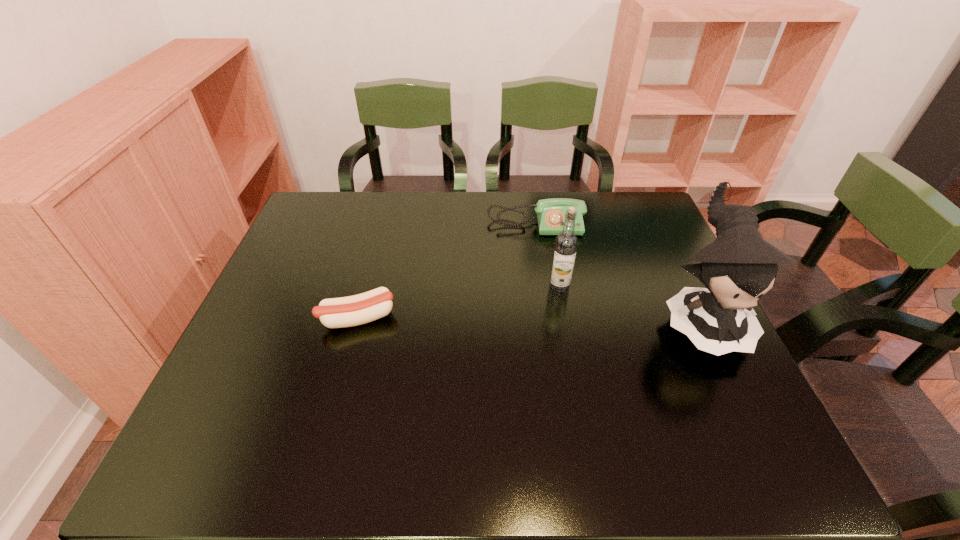
I want to click on empty location between the vodka and the sausage, so click(x=458, y=303).

At what (x,y) coordinates should I click in order to perform the action: click on free point between the second tallest object and the farthest object. Please return your answer as a coordinate pair (x, y). The width and height of the screenshot is (960, 540). Looking at the image, I should click on (547, 256).

Find the location of a particular element. The width and height of the screenshot is (960, 540). free spot between the leftmost object and the farthest object is located at coordinates (446, 271).

Identify the location of the closest object to the telephone. (566, 242).

Choose which object is the third nearest neighbor to the farthest object. Please provide its 2D coordinates. Your answer should be formatted as a tuple, i.e. [(x, y)], where the tuple contains the x and y coordinates of a point satisfying the conditions above.

[(366, 307)]

The height and width of the screenshot is (540, 960). What are the coordinates of `free space that satisfies the following two spatial constraints: 1. on the front side of the vodka; 2. on the left side of the second shortest object` in the screenshot? It's located at (546, 288).

The width and height of the screenshot is (960, 540). Identify the location of free region that satisfies the following two spatial constraints: 1. on the back side of the third tallest object; 2. on the left side of the shortest object. (383, 225).